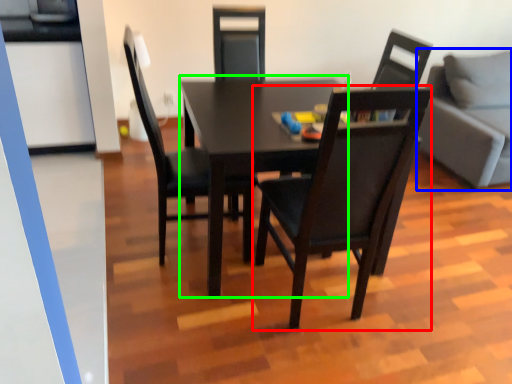
Question: Which object is positioned farthest from chair (highlighted by a red box)? Select from studio couch (highlighted by a blue box) and table (highlighted by a green box).

Choices:
 (A) studio couch
 (B) table

Answer: (A)